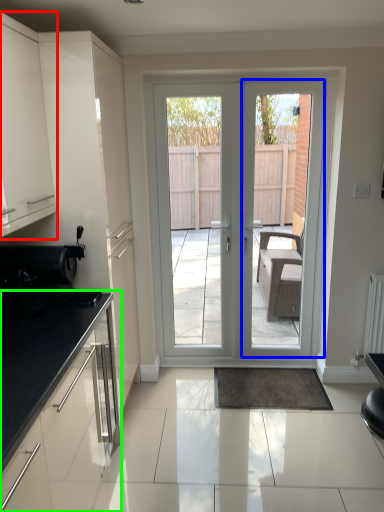
Question: Which is nearer to the cabinetry (highlighted by a red box)? screen door (highlighted by a blue box) or cabinetry (highlighted by a green box).

Choices:
 (A) screen door
 (B) cabinetry

Answer: (B)